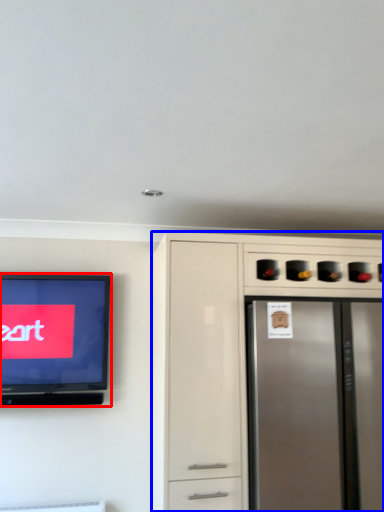
Question: Which object appears farthest to the camera in this image, television (highlighted by a red box) or cabinetry (highlighted by a blue box)?

Choices:
 (A) television
 (B) cabinetry

Answer: (A)